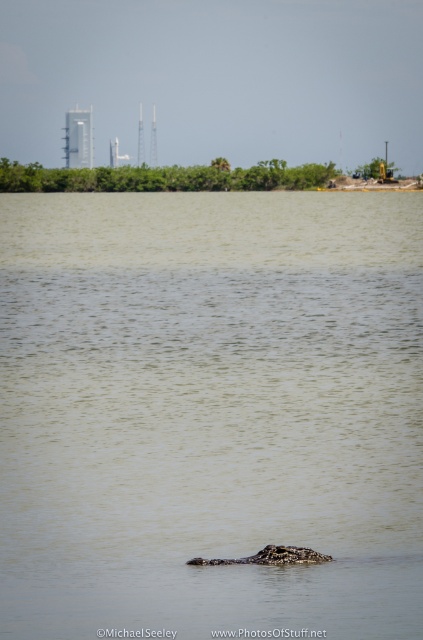
You are a wildlife photographer aiming to capture a clear photo of the dark brown textured crocodile at center. The camera you are using has a maximum focus range of 1.5 meters. Given the scene described, can you determine if the brown textured water at center will interfere with your ability to focus on the crocodile?

The brown textured water at center is wider than the dark brown textured crocodile at center. Since the water is wider, it might occupy more of the camera frame, potentially making it harder to focus on the crocodile. However, the focus range of 1.5 meters depends on the distance between the camera and the crocodile, not the width of the water. If the crocodile is within 1.5 meters, the camera can focus despite the water width.

You are a wildlife photographer aiming to capture the dark brown textured crocodile at center in the brown textured water at center. Considering the size difference between them, which one would occupy more space in your photo frame?

The brown textured water at center occupies more space in the photo frame than the dark brown textured crocodile at center because it is larger in size.

You are standing at the edge of the water in the scene. There is a point at coordinates (209, 410) where brown textured water at center is located. If you want to reach that point without getting into the water, which direction should you move relative to your current position?

The point at coordinates (209, 410) is located at the center of the scene. Since you are at the edge, you should move towards the center to reach it without entering the water.